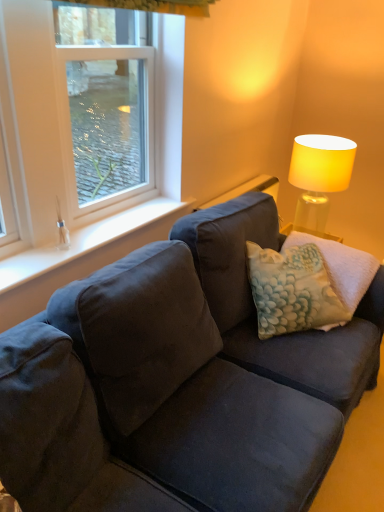
What are the coordinates of `free point above matte yellow fabric lampshade at upper right (from a real-world perspective)` in the screenshot? It's located at (326, 138).